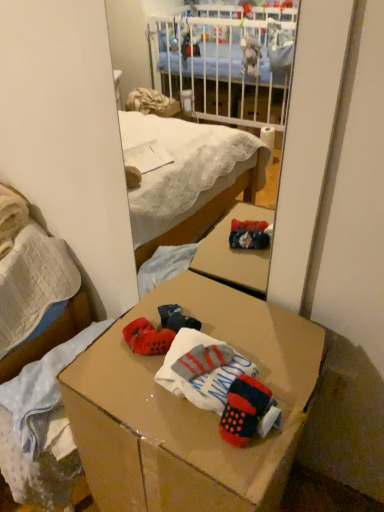
Question: Considering the relative positions of knitted wool socks at center and cardboard box at center in the image provided, is knitted wool socks at center to the left or to the right of cardboard box at center?

Choices:
 (A) left
 (B) right

Answer: (B)

Question: In terms of width, does knitted wool socks at center look wider or thinner when compared to cardboard box at center?

Choices:
 (A) thin
 (B) wide

Answer: (A)

Question: Estimate the real-world distances between objects in this image. Which object is farther from the knitted wool socks at center?

Choices:
 (A) cardboard box at center
 (B) matte cardboard box at lower center

Answer: (B)

Question: Which of these objects is positioned closest to the matte cardboard box at lower center?

Choices:
 (A) knitted wool socks at center
 (B) cardboard box at center

Answer: (B)